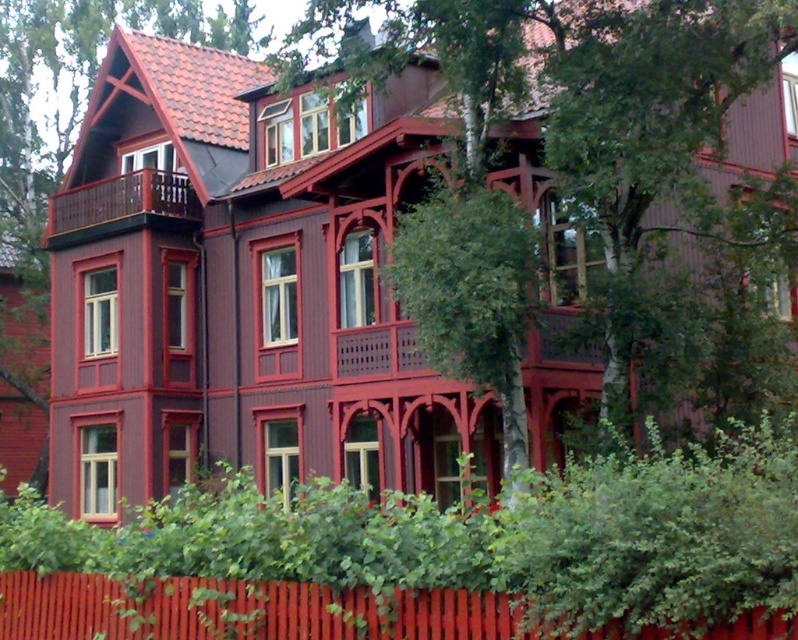
Is point (42, 588) positioned in front of point (176, 177)?

Yes, point (42, 588) is in front of point (176, 177).

Who is more distant from viewer, (x=725, y=628) or (x=182, y=216)?

The point (x=182, y=216) is behind.

Locate an element on the screen. This screenshot has height=640, width=798. smooth wooden fence at lower center is located at coordinates (243, 611).

This screenshot has width=798, height=640. What are the coordinates of `green leafy tree at center` in the screenshot? It's located at (471, 289).

In the scene shown: Does green leafy tree at center have a greater width compared to brown wooden balcony at left?

Incorrect, green leafy tree at center's width does not surpass brown wooden balcony at left's.

Identify the location of green leafy tree at center. The image size is (798, 640). (471, 289).

Identify the location of green leafy tree at center. (471, 289).

Is smooth wooden fence at lower center thinner than green leafy tree at center?

No.

The width and height of the screenshot is (798, 640). What do you see at coordinates (243, 611) in the screenshot?
I see `smooth wooden fence at lower center` at bounding box center [243, 611].

Is point (267, 616) positioned in front of point (512, 384)?

Yes, it is.

Identify the location of smooth wooden fence at lower center. (243, 611).